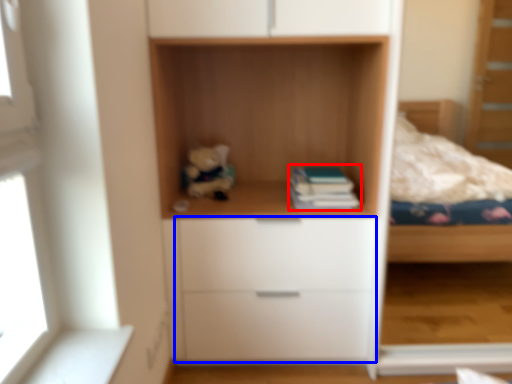
Question: Among these objects, which one is nearest to the camera, paperback book (highlighted by a red box) or drawer (highlighted by a blue box)?

Choices:
 (A) paperback book
 (B) drawer

Answer: (B)